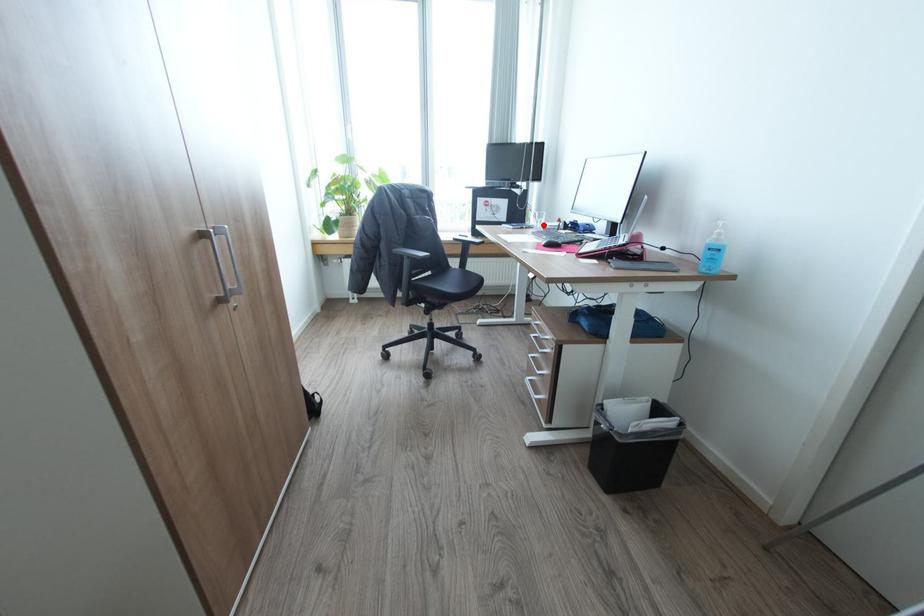
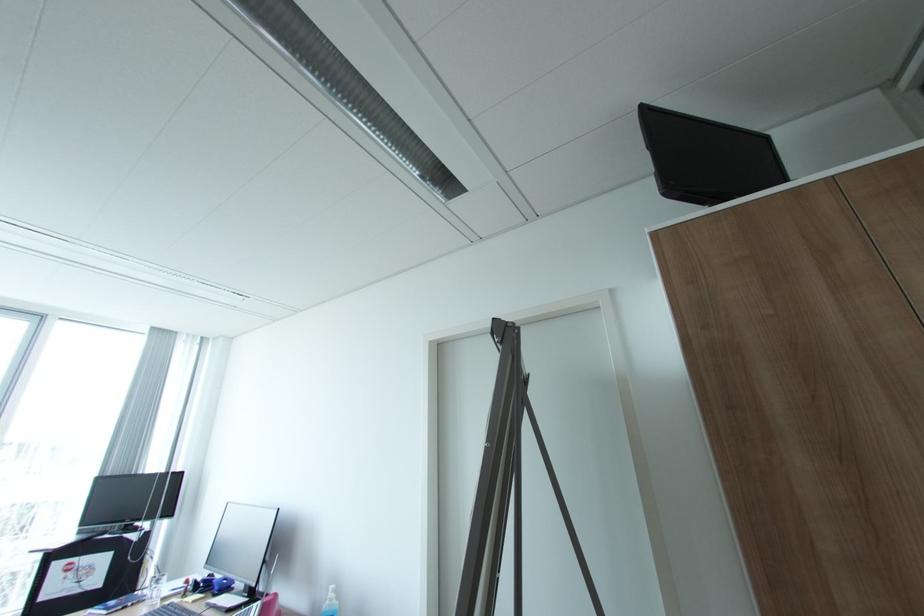
Where in the second image is the point corresponding to the highlighted location from the first image?

(160, 596)